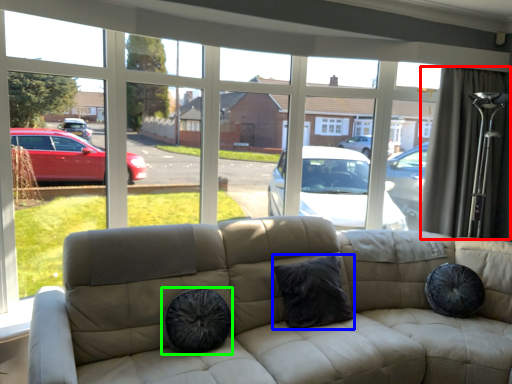
Question: Which object is the closest to the curtain (highlighted by a red box)? Choose among these: pillow (highlighted by a blue box) or dog bed (highlighted by a green box).

Choices:
 (A) pillow
 (B) dog bed

Answer: (A)